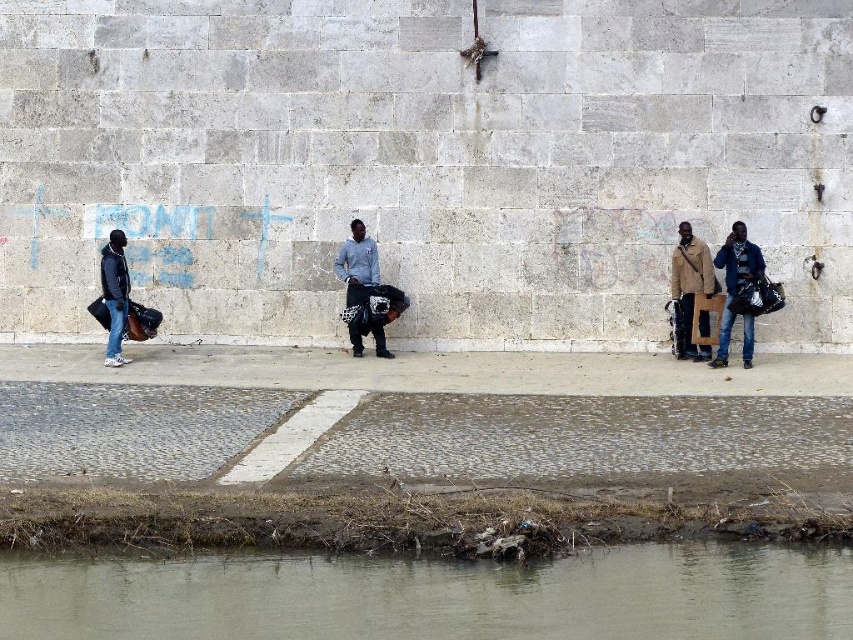
Question: Does dark blue jacket at left have a smaller size compared to dark gray fabric bag at center?

Choices:
 (A) no
 (B) yes

Answer: (B)

Question: Which point is farther to the camera?

Choices:
 (A) (705, 310)
 (B) (729, 236)
 (C) (341, 275)
 (D) (126, 360)

Answer: (C)

Question: Is jeans at right to the right of dark gray fabric bag at center from the viewer's perspective?

Choices:
 (A) yes
 (B) no

Answer: (A)

Question: Can you confirm if jeans at right is positioned to the left of dark blue jacket at left?

Choices:
 (A) yes
 (B) no

Answer: (B)

Question: Which object is closer to the camera taking this photo?

Choices:
 (A) jeans at right
 (B) dark blue jacket at left
 (C) dark gray fabric bag at center

Answer: (A)

Question: Which point is farther from the camera taking this photo?

Choices:
 (A) (340, 253)
 (B) (122, 240)

Answer: (A)